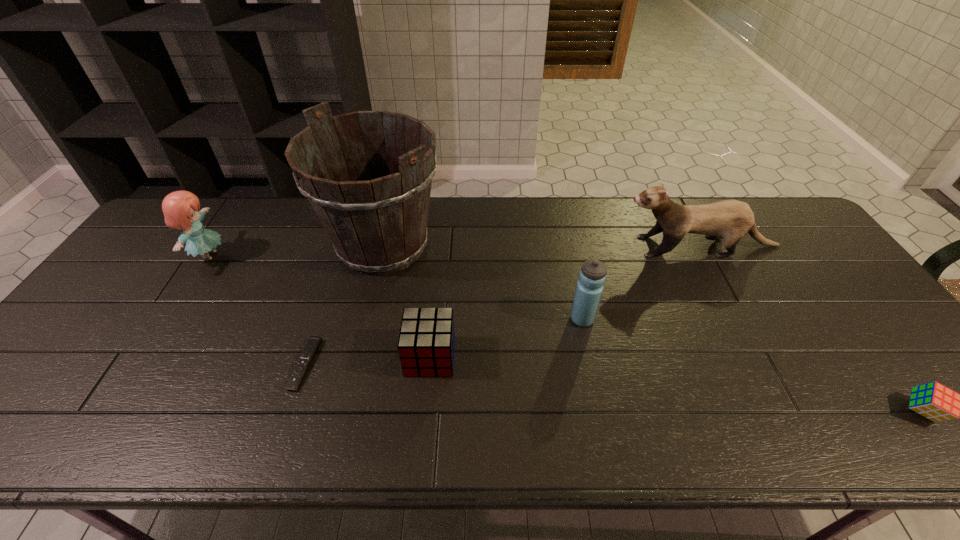
Identify which object is located as the third nearest to the tallest object. Please provide its 2D coordinates. Your answer should be formatted as a tuple, i.e. [(x, y)], where the tuple contains the x and y coordinates of a point satisfying the conditions above.

[(180, 208)]

The width and height of the screenshot is (960, 540). In order to click on object that ranks as the third closest to the bucket in this screenshot , I will do `click(180, 208)`.

Find the location of a particular element. free spot that satisfies the following two spatial constraints: 1. on the front-facing side of the shortest object; 2. on the right side of the leftmost object is located at coordinates (139, 364).

Locate an element on the screen. The image size is (960, 540). vacant position in the image that satisfies the following two spatial constraints: 1. on the front side of the sixth tallest object; 2. on the right side of the tallest object is located at coordinates (344, 411).

Image resolution: width=960 pixels, height=540 pixels. I want to click on free region that satisfies the following two spatial constraints: 1. on the front side of the tallest object; 2. on the front-facing side of the doll, so click(380, 256).

Where is `free point that satisfies the following two spatial constraints: 1. on the front-facing side of the leftmost object; 2. on the right side of the remote control`? free point that satisfies the following two spatial constraints: 1. on the front-facing side of the leftmost object; 2. on the right side of the remote control is located at coordinates (139, 364).

Locate an element on the screen. This screenshot has width=960, height=540. vacant space that satisfies the following two spatial constraints: 1. on the back side of the nearest object; 2. on the front-facing side of the doll is located at coordinates (804, 256).